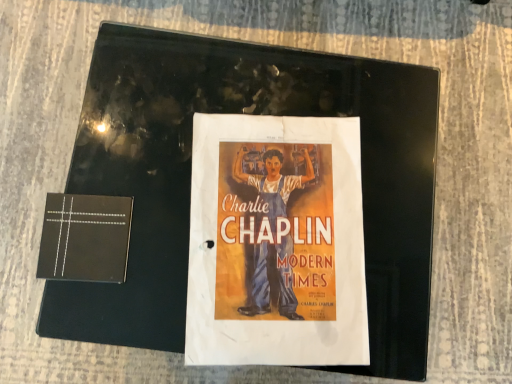
Locate an element on the screen. Image resolution: width=512 pixels, height=384 pixels. blank space situated above matte paper poster at center (from a real-world perspective) is located at coordinates (260, 224).